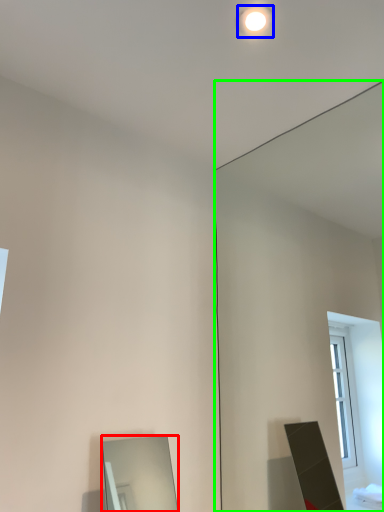
Question: Which object is the closest to the mirror (highlighted by a red box)? Choose among these: lighting (highlighted by a blue box) or mirror (highlighted by a green box).

Choices:
 (A) lighting
 (B) mirror

Answer: (B)